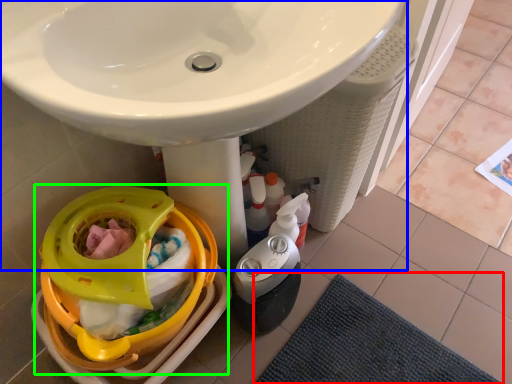
Question: Which object is positioned farthest from bath mat (highlighted by a red box)? Select from sink (highlighted by a blue box) and baby carriage (highlighted by a green box).

Choices:
 (A) sink
 (B) baby carriage

Answer: (A)